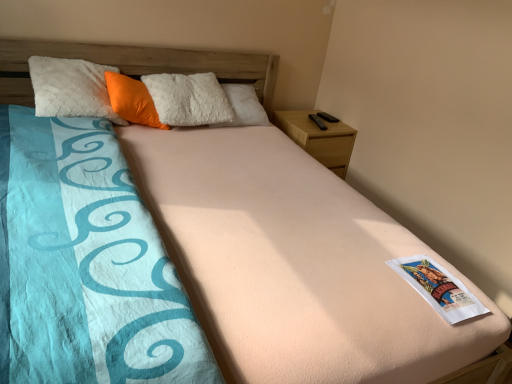
What is the approximate height of white paper at center?

2.77 inches.

Find the location of a particular element. wooden nightstand at upper right is located at coordinates (319, 138).

Would you say orange plush pillow at upper left is a long distance from wooden nightstand at upper right?

That's right, there is a large distance between orange plush pillow at upper left and wooden nightstand at upper right.

Is point (120, 88) in front of point (301, 131)?

That is True.

In terms of size, does orange plush pillow at upper left appear bigger or smaller than wooden nightstand at upper right?

Considering their sizes, orange plush pillow at upper left takes up less space than wooden nightstand at upper right.

Can you confirm if orange plush pillow at upper left is wider than wooden nightstand at upper right?

In fact, orange plush pillow at upper left might be narrower than wooden nightstand at upper right.

What's the angular difference between white paper at center and orange plush pillow at upper left's facing directions?

There is a 53.5-degree angle between the facing directions of white paper at center and orange plush pillow at upper left.

The height and width of the screenshot is (384, 512). What are the coordinates of `paperback book that appears in front of the orange plush pillow at upper left` in the screenshot? It's located at (438, 288).

From the image's perspective, is white paper at center located beneath orange plush pillow at upper left?

Correct, white paper at center appears lower than orange plush pillow at upper left in the image.

Does white paper at center turn towards orange plush pillow at upper left?

No, white paper at center is not oriented towards orange plush pillow at upper left.

Consider the image. Is wooden nightstand at upper right shorter than white paper at center?

In fact, wooden nightstand at upper right may be taller than white paper at center.

Is wooden nightstand at upper right to the left or to the right of white paper at center in the image?

In the image, wooden nightstand at upper right appears on the left side of white paper at center.

How far apart are wooden nightstand at upper right and white paper at center?

wooden nightstand at upper right and white paper at center are 4.58 feet apart.

From a real-world perspective, is wooden nightstand at upper right physically above white paper at center?

No, from a real-world perspective, wooden nightstand at upper right is not above white paper at center.

Is white paper at center oriented away from wooden nightstand at upper right?

Yes.

From the image's perspective, is white paper at center above or below wooden nightstand at upper right?

From the image's perspective, white paper at center appears below wooden nightstand at upper right.

From a real-world perspective, relative to wooden nightstand at upper right, is white paper at center vertically above or below?

Clearly, from a real-world perspective, white paper at center is above wooden nightstand at upper right.

Where is `pillow on the left of wooden nightstand at upper right`? pillow on the left of wooden nightstand at upper right is located at coordinates (132, 100).

Is wooden nightstand at upper right not within orange plush pillow at upper left?

Indeed, wooden nightstand at upper right is completely outside orange plush pillow at upper left.

Is wooden nightstand at upper right to the left of orange plush pillow at upper left from the viewer's perspective?

In fact, wooden nightstand at upper right is to the right of orange plush pillow at upper left.

Which is closer to the camera, (138, 93) or (428, 274)?

The point (428, 274) is more forward.

From a real-world perspective, is orange plush pillow at upper left on white paper at center?

Correct, in the physical world, orange plush pillow at upper left is higher than white paper at center.

How many degrees apart are the facing directions of orange plush pillow at upper left and white paper at center?

53.5 degrees separate the facing orientations of orange plush pillow at upper left and white paper at center.

Between orange plush pillow at upper left and white paper at center, which one has smaller size?

With smaller size is white paper at center.

You are a GUI agent. You are given a task and a screenshot of the screen. Output one action in this format:
    pyautogui.click(x=<x>, y=<y>)
    Task: Click on the nightstand behind the orange plush pillow at upper left
    
    Given the screenshot: What is the action you would take?
    pyautogui.click(x=319, y=138)

Image resolution: width=512 pixels, height=384 pixels. In order to click on paperback book below the orange plush pillow at upper left (from a real-world perspective) in this screenshot , I will do `click(438, 288)`.

Based on the photo, which object lies nearer to the anchor point orange plush pillow at upper left, wooden nightstand at upper right or white paper at center?

wooden nightstand at upper right is positioned closer to the anchor orange plush pillow at upper left.

Estimate the real-world distances between objects in this image. Which object is further from wooden nightstand at upper right, orange plush pillow at upper left or white paper at center?

white paper at center is further to wooden nightstand at upper right.

Considering their positions, is wooden nightstand at upper right positioned closer to white paper at center than orange plush pillow at upper left?

wooden nightstand at upper right.

From the image, which object appears to be nearer to white paper at center, orange plush pillow at upper left or wooden nightstand at upper right?

wooden nightstand at upper right lies closer to white paper at center than the other object.

When comparing their distances from orange plush pillow at upper left, does white paper at center or wooden nightstand at upper right seem further?

white paper at center is positioned further to the anchor orange plush pillow at upper left.

When comparing their distances from wooden nightstand at upper right, does white paper at center or orange plush pillow at upper left seem further?

white paper at center is further to wooden nightstand at upper right.

In order to click on nightstand between orange plush pillow at upper left and white paper at center from left to right in this screenshot , I will do `click(319, 138)`.